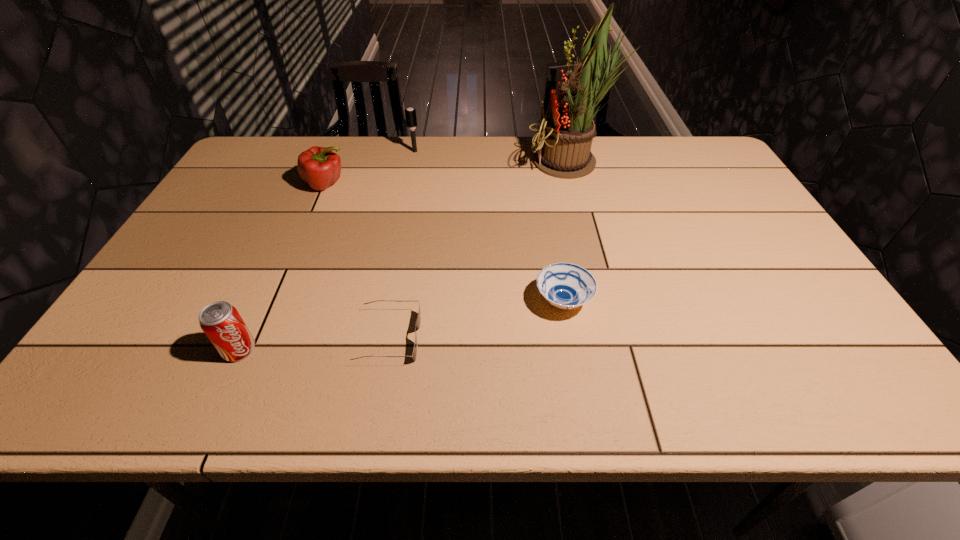
Find the location of a particular element. This screenshot has width=960, height=540. vacant space located on the right of the bell pepper is located at coordinates (472, 184).

At what (x,y) coordinates should I click in order to perform the action: click on vacant space located on the back of the soda can. Please return your answer as a coordinate pair (x, y). The height and width of the screenshot is (540, 960). Looking at the image, I should click on (258, 308).

Identify the location of vacant region located 0.230m on the back of the soup bowl. This screenshot has height=540, width=960. (549, 220).

At what (x,y) coordinates should I click in order to perform the action: click on vacant space situated on the front-facing side of the shortest object. Please return your answer as a coordinate pair (x, y). The image size is (960, 540). Looking at the image, I should click on (446, 338).

Find the location of a particular element. This screenshot has width=960, height=540. flower arrangement positioned at the far edge is located at coordinates (564, 140).

The width and height of the screenshot is (960, 540). What are the coordinates of `hairbrush that is at the far edge` in the screenshot? It's located at (410, 113).

Where is `bell pepper located in the far edge section of the desktop`? The width and height of the screenshot is (960, 540). bell pepper located in the far edge section of the desktop is located at coordinates (318, 166).

Find the location of a particular element. Image resolution: width=960 pixels, height=540 pixels. vacant space at the far edge of the desktop is located at coordinates (371, 160).

What are the coordinates of `free location at the near edge` in the screenshot? It's located at (322, 395).

Locate an element on the screen. This screenshot has width=960, height=540. vacant space at the left edge of the desktop is located at coordinates (209, 210).